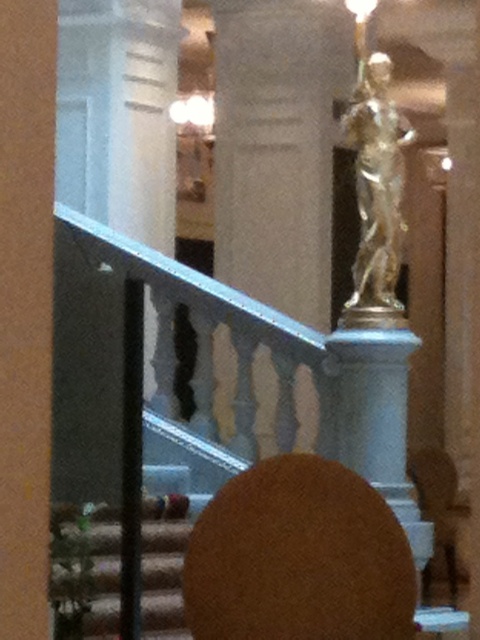
Is point (360, 154) behind point (457, 557)?

That is False.

Who is taller, gold metallic statue at upper center or brown leather chair at lower right?

gold metallic statue at upper center is taller.

You are a GUI agent. You are given a task and a screenshot of the screen. Output one action in this format:
    pyautogui.click(x=<x>, y=<y>)
    Task: Click on the gold metallic statue at upper center
    
    Given the screenshot: What is the action you would take?
    pyautogui.click(x=376, y=195)

Locate an element on the screen. This screenshot has height=640, width=480. gold metallic statue at upper center is located at coordinates pos(376,195).

Between white marble pillar at center and brown leather chair at lower right, which one is positioned lower?

Positioned lower is brown leather chair at lower right.

Is white marble pillar at center above brown leather chair at lower right?

Yes, white marble pillar at center is above brown leather chair at lower right.

Who is more forward, (304, 428) or (439, 564)?

Point (304, 428) is in front.

What are the coordinates of `white marble pillar at center` in the screenshot? It's located at coord(277,147).

This screenshot has height=640, width=480. Describe the element at coordinates (277, 147) in the screenshot. I see `white marble pillar at center` at that location.

In the scene shown: Which is above, white marble pillar at center or gold metallic statue at upper center?

white marble pillar at center is above.

The height and width of the screenshot is (640, 480). I want to click on white marble pillar at center, so click(x=277, y=147).